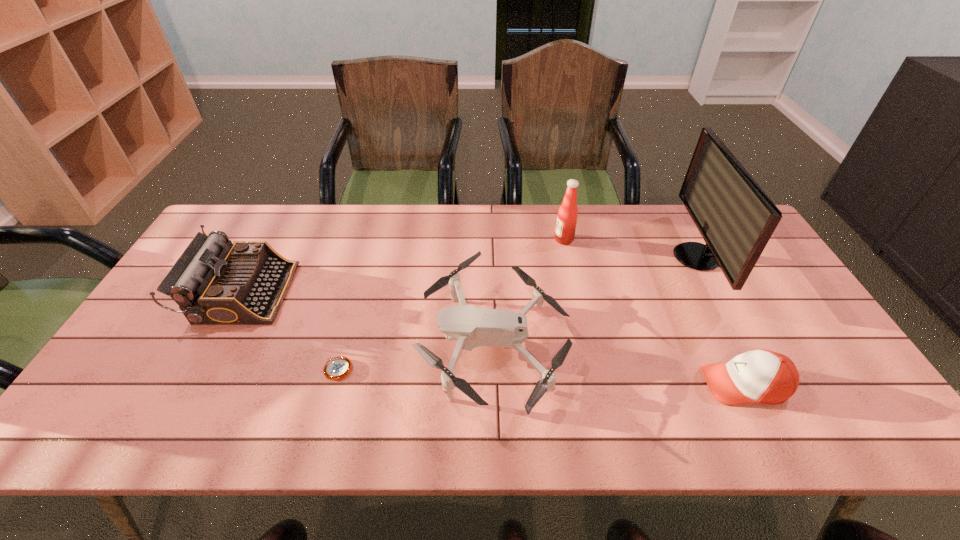
You are a GUI agent. You are given a task and a screenshot of the screen. Output one action in this format:
    pyautogui.click(x=<x>, y=<y>)
    Task: Click on the vacant region that satisfies the following two spatial constraints: 1. on the front-facing side of the third object from right to left; 2. on the front side of the fifth object from right to left
    The image size is (960, 540).
    Given the screenshot: What is the action you would take?
    pyautogui.click(x=591, y=369)